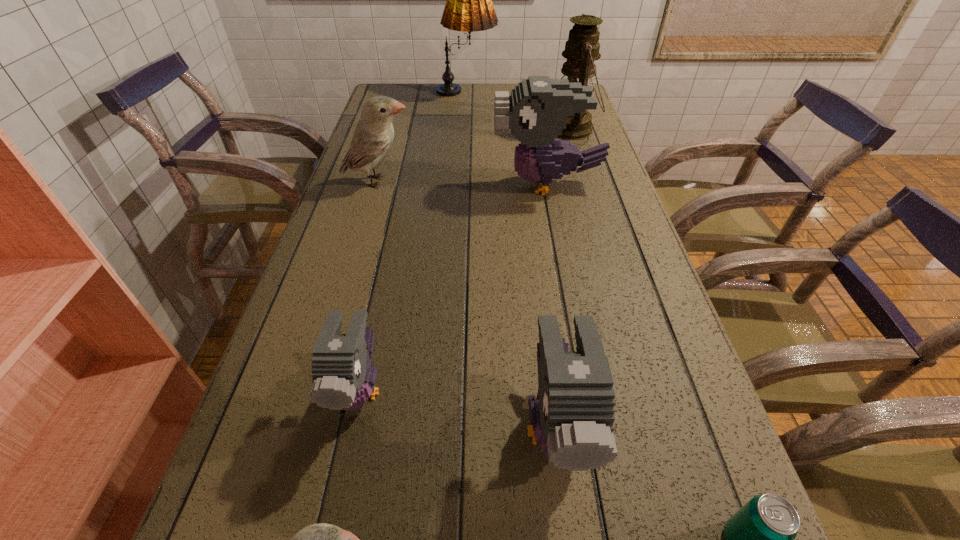
Image resolution: width=960 pixels, height=540 pixels. Find the location of `vacant space situated at the beak of the farthest gray bird`. vacant space situated at the beak of the farthest gray bird is located at coordinates (457, 184).

Locate an element on the screen. The width and height of the screenshot is (960, 540). vacant region located 0.400m at the beak of the farthest gray bird is located at coordinates (349, 184).

Locate an element on the screen. This screenshot has width=960, height=540. vacant space situated at the face of the farther white bird is located at coordinates pos(454,181).

Where is `vacant space located 0.100m at the beak of the smallest gray bird`? vacant space located 0.100m at the beak of the smallest gray bird is located at coordinates (334, 505).

Find the location of a particular element. object that is at the far edge is located at coordinates (469, 8).

At what (x,y) coordinates should I click in order to perform the action: click on oil lamp located at the right edge. Please return your answer as a coordinate pair (x, y). The width and height of the screenshot is (960, 540). Looking at the image, I should click on (582, 48).

Locate an element on the screen. The height and width of the screenshot is (540, 960). bird that is at the right edge is located at coordinates (536, 112).

Locate an element on the screen. free space at the far edge is located at coordinates (496, 91).

The height and width of the screenshot is (540, 960). Find the location of `vacant space at the right edge of the desktop`. vacant space at the right edge of the desktop is located at coordinates [603, 276].

This screenshot has width=960, height=540. What are the coordinates of `vacant region at the far left corner of the desktop` in the screenshot? It's located at coord(391,87).